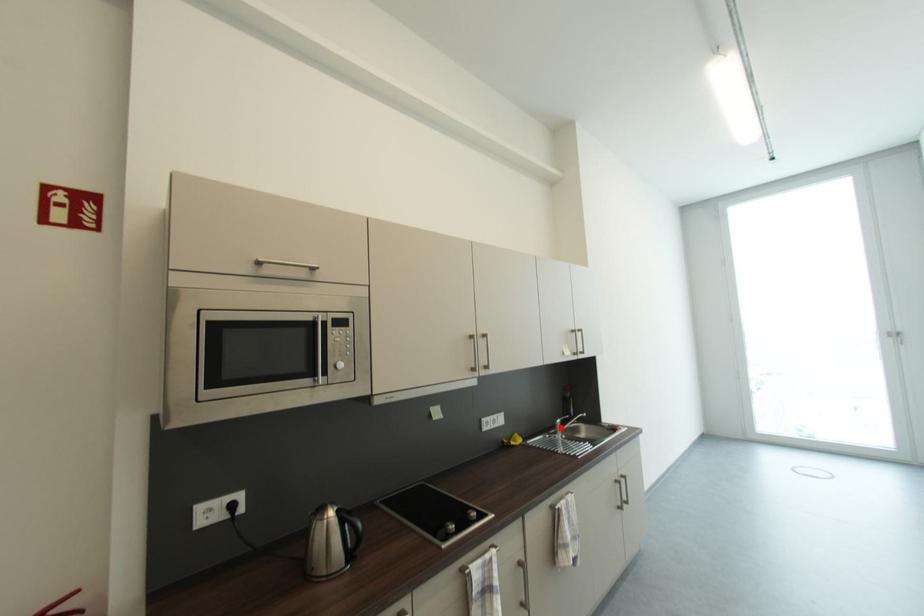
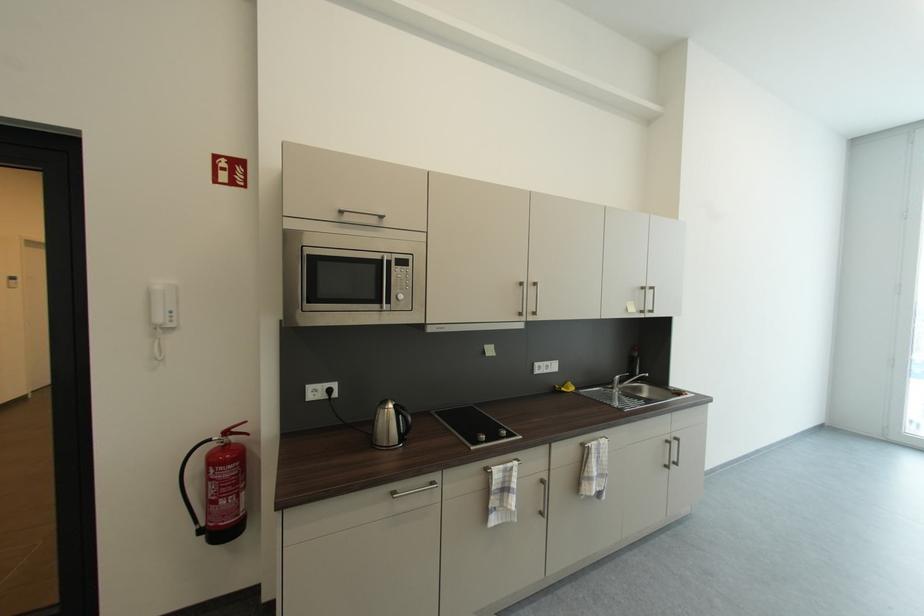
In the second image, find the point that corresponds to the highlighted location in the first image.

(618, 383)